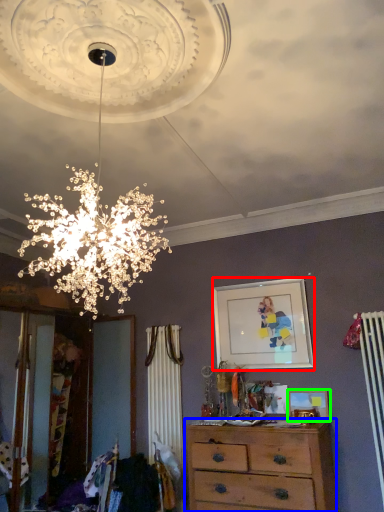
Question: Which object is positioned farthest from picture frame (highlighted by a red box)? Select from chest of drawers (highlighted by a blue box) and picture frame (highlighted by a green box).

Choices:
 (A) chest of drawers
 (B) picture frame

Answer: (A)